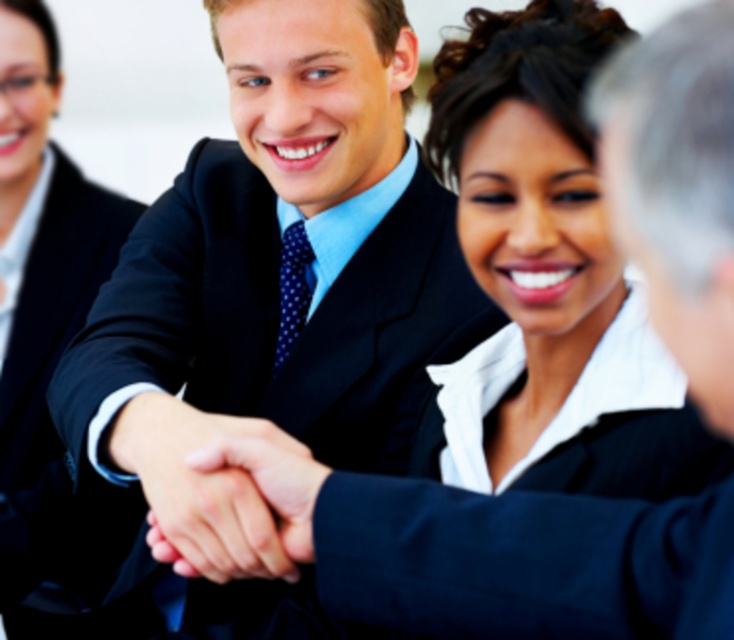
Looking at this image, does black smooth suit at center have a lesser height compared to smooth skin handshake at center?

No, black smooth suit at center is not shorter than smooth skin handshake at center.

Does black smooth suit at center appear on the right side of smooth skin handshake at center?

No, black smooth suit at center is not to the right of smooth skin handshake at center.

Is point (46, 257) closer to camera compared to point (210, 541)?

No.

Where is `black smooth suit at center`? Image resolution: width=734 pixels, height=640 pixels. black smooth suit at center is located at coordinates coord(48,372).

Is black satin business suit at center taller than smooth skin handshake at center?

Yes.

Is point (181, 291) behind point (195, 572)?

Yes, point (181, 291) is behind point (195, 572).

Identify the location of black satin business suit at center. The image size is (734, 640). (277, 316).

Consider the image. Does black satin business suit at center have a greater height compared to black smooth suit at center?

In fact, black satin business suit at center may be shorter than black smooth suit at center.

Locate an element on the screen. black satin business suit at center is located at coordinates (277, 316).

Locate an element on the screen. black satin business suit at center is located at coordinates (277, 316).